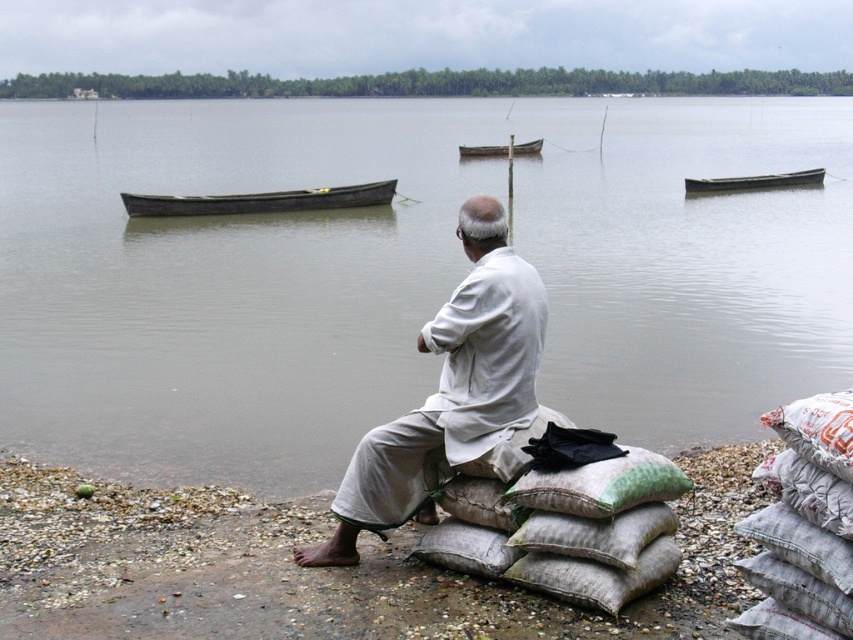
Question: Which point is farther to the camera?

Choices:
 (A) wooden boat at center
 (B) white cotton shirt at center
 (C) clear water at center

Answer: (A)

Question: Which point is closer to the camera?

Choices:
 (A) (769, 173)
 (B) (238, 390)
 (C) (482, 154)

Answer: (B)

Question: Does white cotton shirt at center have a lesser width compared to wooden canoe at center?

Choices:
 (A) no
 (B) yes

Answer: (B)

Question: Is white cotton shirt at center positioned behind wooden canoe at center?

Choices:
 (A) yes
 (B) no

Answer: (B)

Question: Based on their relative distances, which object is farther from the dark gray wooden boat at center?

Choices:
 (A) white cotton shirt at center
 (B) clear water at center
 (C) wooden boat at center
 (D) wooden canoe at center

Answer: (A)

Question: Is gray gravel shoreline at lower left below wooden boat at center?

Choices:
 (A) no
 (B) yes

Answer: (B)